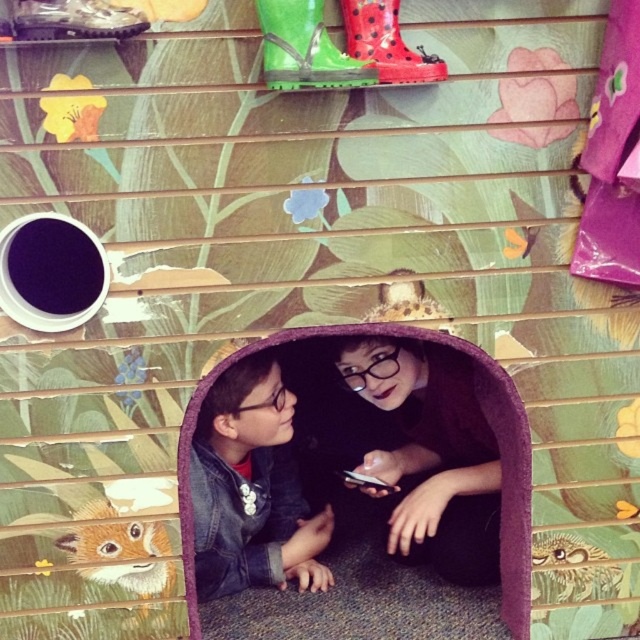
Question: Can you confirm if matte black jacket at lower left is positioned to the left of brown furry fox at lower left?

Choices:
 (A) yes
 (B) no

Answer: (B)

Question: Which point is farther to the camera?

Choices:
 (A) (445, 364)
 (B) (236, 488)
 (C) (150, 536)

Answer: (A)

Question: Is the position of denim jacket at lower center more distant than that of brown furry fox at lower left?

Choices:
 (A) no
 (B) yes

Answer: (A)

Question: Which point is farther from the camera taking this photo?

Choices:
 (A) (410, 376)
 (B) (154, 580)

Answer: (A)

Question: Is matte black jacket at lower left below brown furry fox at lower left?

Choices:
 (A) no
 (B) yes

Answer: (A)

Question: Estimate the real-world distances between objects in this image. Which object is closer to the denim jacket at lower center?

Choices:
 (A) matte black jacket at lower left
 (B) brown furry fox at lower left

Answer: (A)